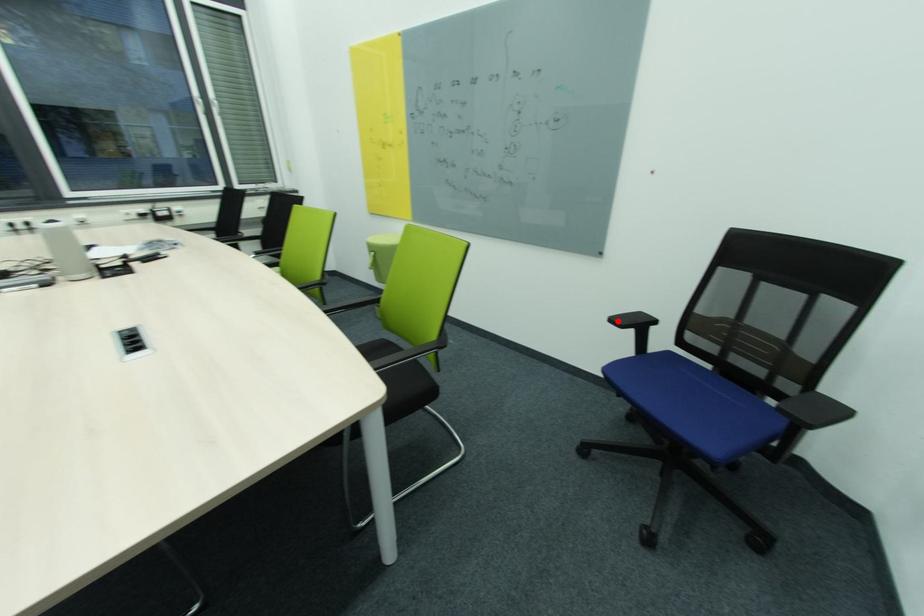
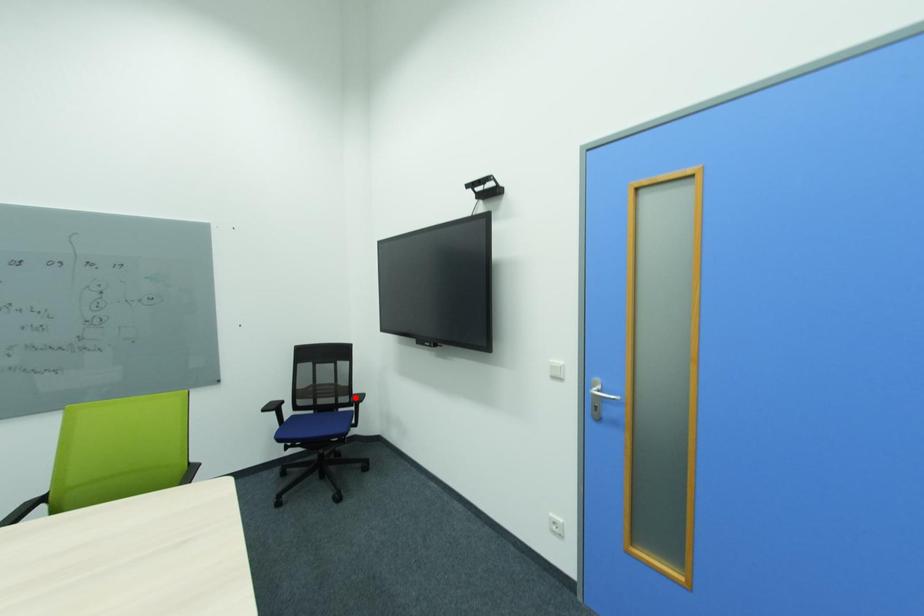
I am providing you with two images of the same scene from different viewpoints. A red point is marked on the first image and another point is marked on the second image. Does the point marked in image1 correspond to the same location as the one in image2?

No